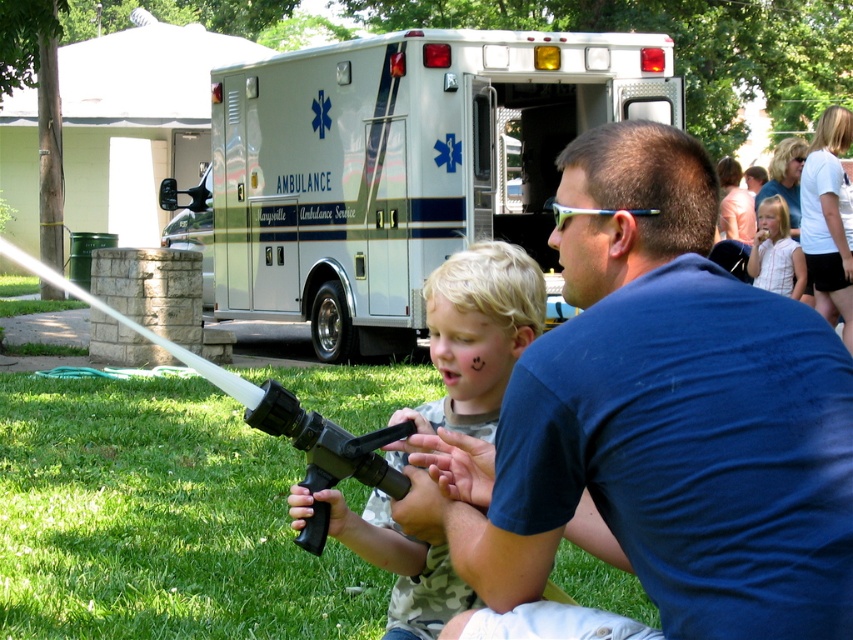
What object is located at the coordinate point (659, 419) in the image?

The point (659, 419) marks the blue cotton shirt at center.

You are a painter who needs to choose between the black plastic hose at lower center and the white striped shirt at upper right for a project requiring a thinner material. Which object should you select?

The black plastic hose at lower center is thinner than the white striped shirt at upper right, so you should select the black plastic hose at lower center for your project.